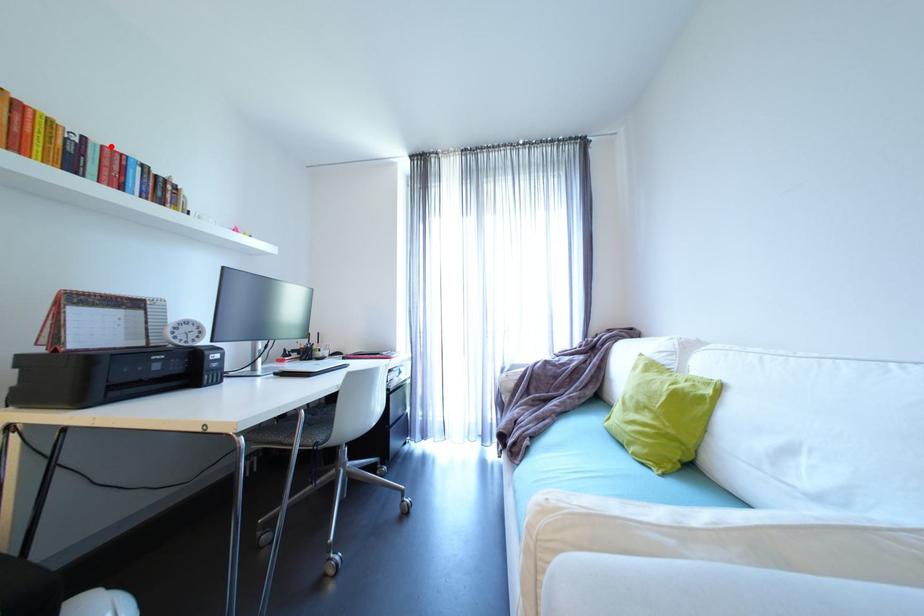
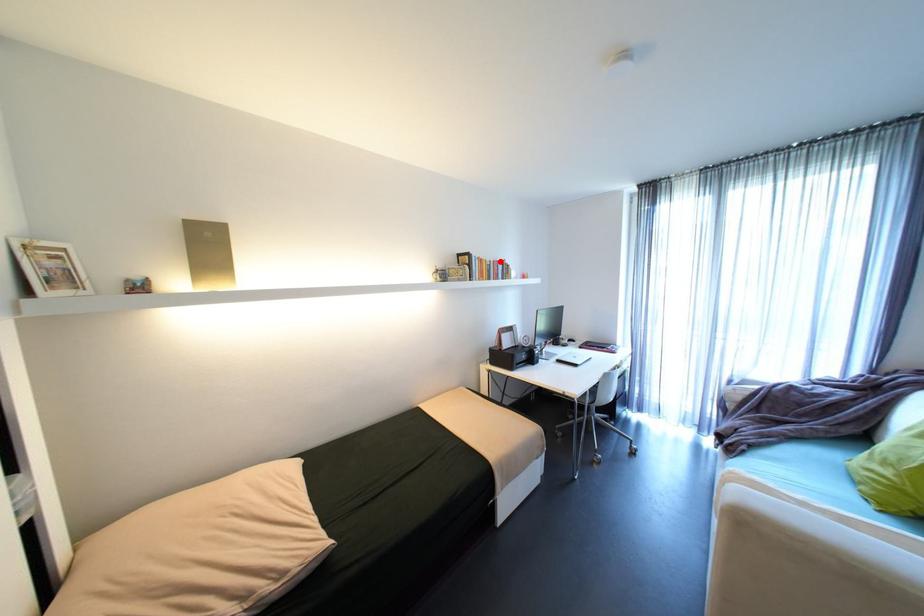
I am providing you with two images of the same scene from different viewpoints. A red point is marked on the first image and another point is marked on the second image. Do the highlighted points in image1 and image2 indicate the same real-world spot?

Yes